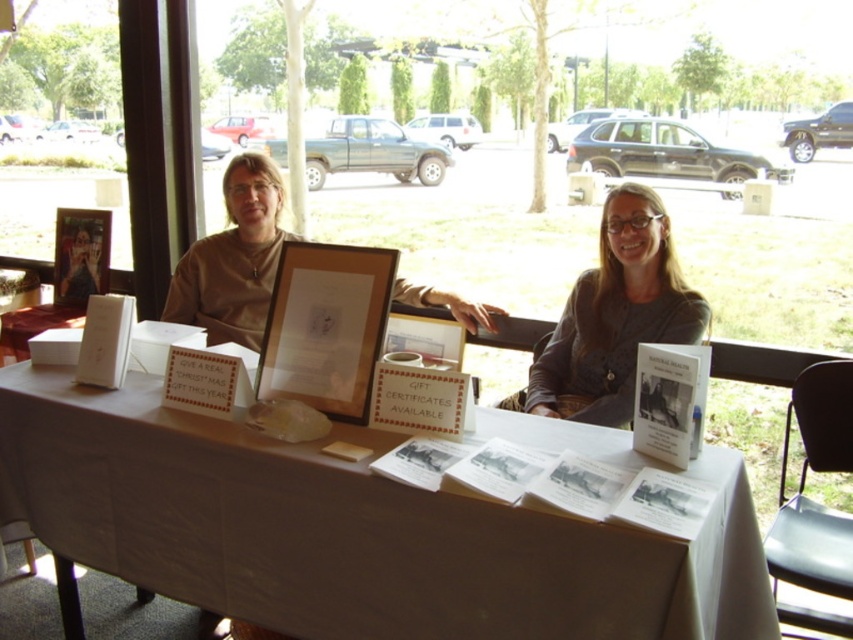
Question: Which object is positioned farthest from the wooden frame at center?

Choices:
 (A) matte glass picture frame at center
 (B) white wood table at center

Answer: (A)

Question: Does gray denim jacket at center appear on the right side of matte glass picture frame at center?

Choices:
 (A) no
 (B) yes

Answer: (B)

Question: Which of the following is the farthest from the observer?

Choices:
 (A) (62, 272)
 (B) (648, 320)
 (C) (463, 300)

Answer: (A)

Question: Among these points, which one is farthest from the camera?

Choices:
 (A) (451, 524)
 (B) (86, 284)
 (C) (677, 268)

Answer: (B)

Question: Is gray denim jacket at center bigger than wooden frame at center?

Choices:
 (A) no
 (B) yes

Answer: (B)

Question: Is gray denim jacket at center below wooden frame at center?

Choices:
 (A) yes
 (B) no

Answer: (B)